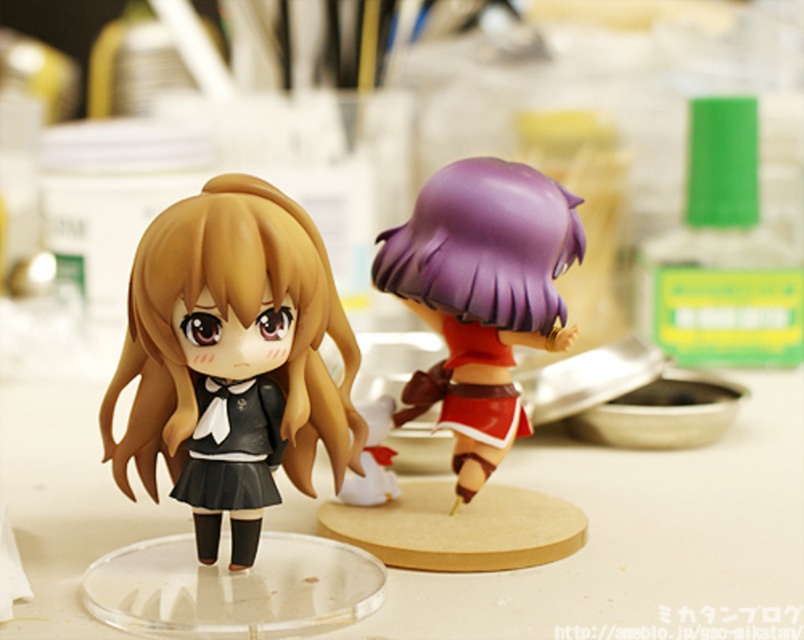
Based on the scene description, where is the matte black doll at left located in terms of coordinates?

The matte black doll at left is located at point (232, 348).

You are organizing a display and need to place the white plastic table at center and the matte black doll at left on a shelf. If the shelf has limited width, which object should be placed first to ensure both fit?

The white plastic table at center is wider than the matte black doll at left, so place it first to accommodate its greater width before positioning the matte black doll at left.